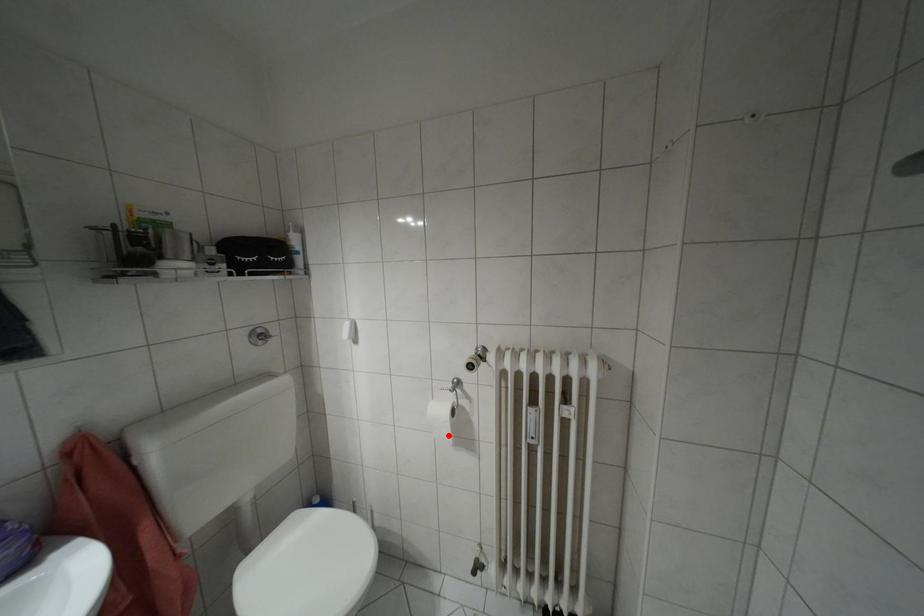
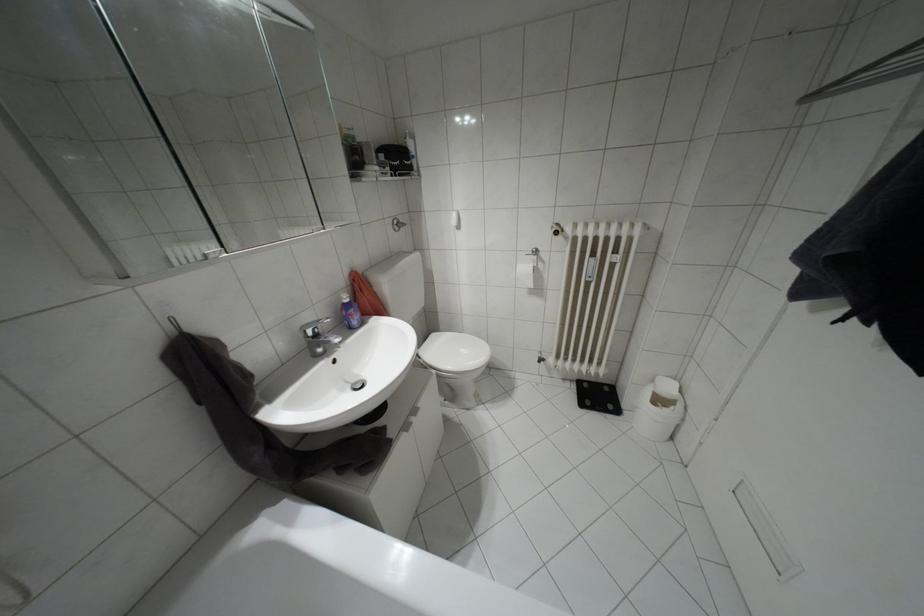
In the second image, find the point that corresponds to the highlighted location in the first image.

(530, 284)